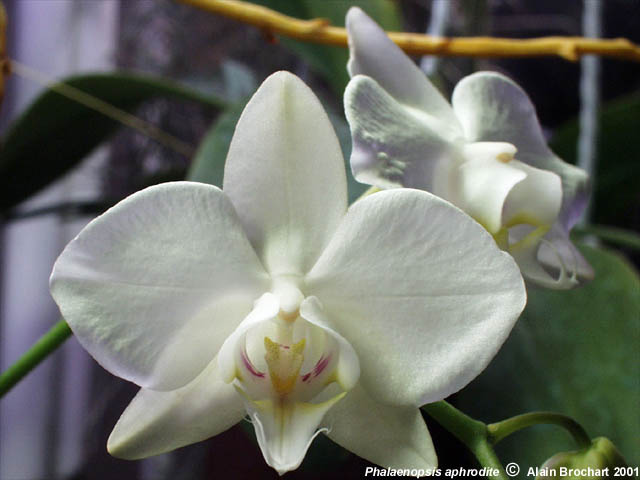
In order to click on window frame in this screenshot , I will do `click(588, 122)`.